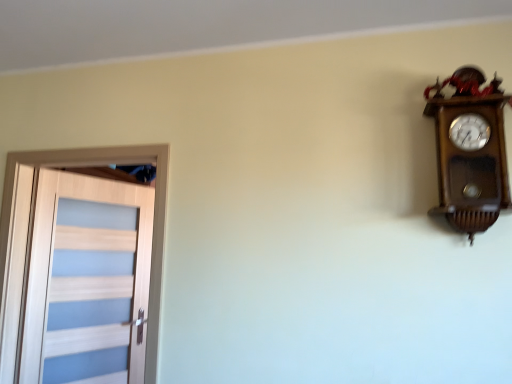
Question: From the image's perspective, would you say wooden wall clock at upper right is shown under light wood door at left?

Choices:
 (A) yes
 (B) no

Answer: (B)

Question: From the image's perspective, does wooden wall clock at upper right appear higher than light wood door at left?

Choices:
 (A) no
 (B) yes

Answer: (B)

Question: Is light wood door at left completely or partially inside wooden wall clock at upper right?

Choices:
 (A) no
 (B) yes

Answer: (A)

Question: Can you confirm if wooden wall clock at upper right is wider than light wood door at left?

Choices:
 (A) no
 (B) yes

Answer: (A)

Question: Does wooden wall clock at upper right have a lesser height compared to light wood door at left?

Choices:
 (A) yes
 (B) no

Answer: (A)

Question: Is wooden wall clock at upper right positioned with its back to light wood door at left?

Choices:
 (A) yes
 (B) no

Answer: (B)

Question: Is light wood door at left taller than wooden wall clock at upper right?

Choices:
 (A) no
 (B) yes

Answer: (B)

Question: Considering the relative positions of light wood door at left and wooden wall clock at upper right in the image provided, is light wood door at left to the right of wooden wall clock at upper right from the viewer's perspective?

Choices:
 (A) no
 (B) yes

Answer: (A)

Question: Does light wood door at left have a larger size compared to wooden wall clock at upper right?

Choices:
 (A) no
 (B) yes

Answer: (B)

Question: Can wooden wall clock at upper right be found inside light wood door at left?

Choices:
 (A) no
 (B) yes

Answer: (A)

Question: From a real-world perspective, is light wood door at left on wooden wall clock at upper right?

Choices:
 (A) no
 (B) yes

Answer: (A)

Question: Can you confirm if light wood door at left is smaller than wooden wall clock at upper right?

Choices:
 (A) no
 (B) yes

Answer: (A)

Question: Considering the relative positions of wooden wall clock at upper right and light wood door at left in the image provided, is wooden wall clock at upper right to the left or to the right of light wood door at left?

Choices:
 (A) right
 (B) left

Answer: (A)